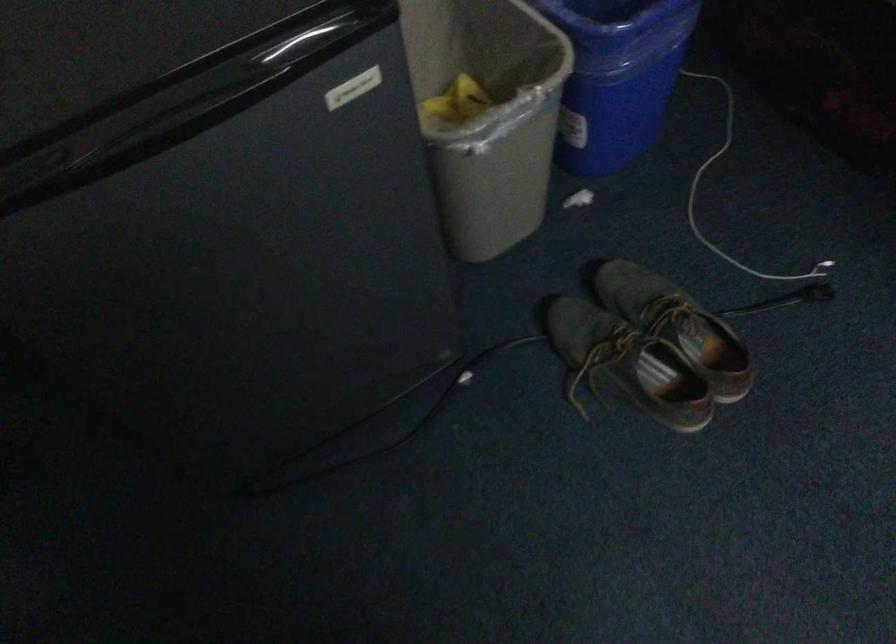
This screenshot has width=896, height=644. Identify the location of beige trash can. (487, 115).